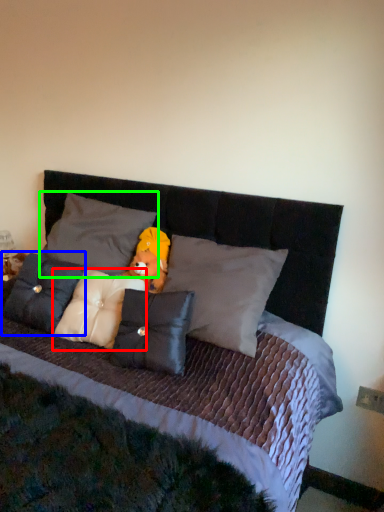
Question: Based on their relative distances, which object is farther from pillow (highlighted by a red box)? Choose from pillow (highlighted by a blue box) and pillow (highlighted by a green box).

Choices:
 (A) pillow
 (B) pillow

Answer: (B)